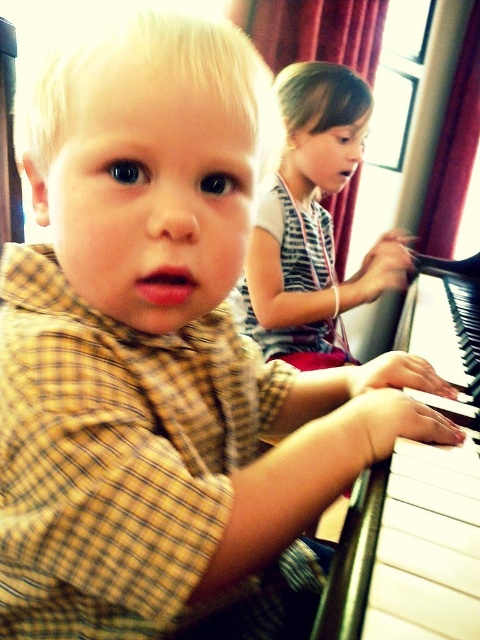
Question: Does white glossy piano at right lie in front of striped fabric shirt at upper center?

Choices:
 (A) yes
 (B) no

Answer: (A)

Question: Which point is closer to the camera?

Choices:
 (A) (286, 269)
 (B) (427, 506)

Answer: (B)

Question: Can you confirm if white glossy piano at right is smaller than striped fabric shirt at upper center?

Choices:
 (A) yes
 (B) no

Answer: (B)

Question: Can you confirm if white glossy piano at right is smaller than striped fabric shirt at upper center?

Choices:
 (A) yes
 (B) no

Answer: (B)